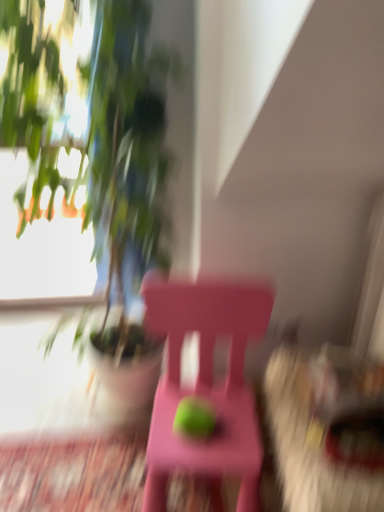
Question: Visually, is pink plastic chair at center positioned to the left or to the right of green matte plant at upper left?

Choices:
 (A) left
 (B) right

Answer: (B)

Question: Considering the positions of pink plastic chair at center and green matte plant at upper left in the image, is pink plastic chair at center bigger or smaller than green matte plant at upper left?

Choices:
 (A) small
 (B) big

Answer: (A)

Question: Estimate the real-world distances between objects in this image. Which object is farther from the green matte plant at upper left?

Choices:
 (A) pink plastic chair at center
 (B) green matte apple at center

Answer: (B)

Question: Considering the real-world distances, which object is farthest from the pink plastic chair at center?

Choices:
 (A) green matte plant at upper left
 (B) green matte apple at center

Answer: (A)